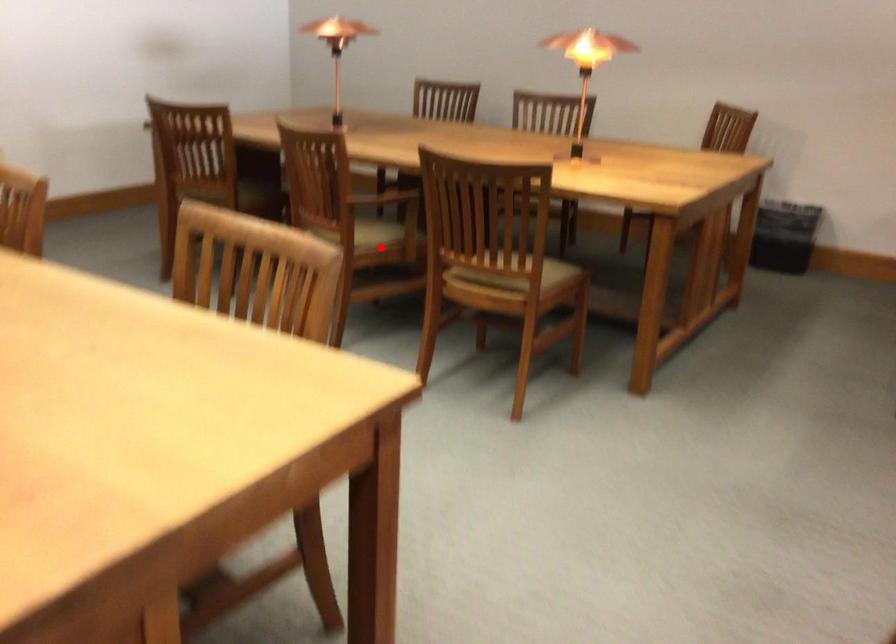
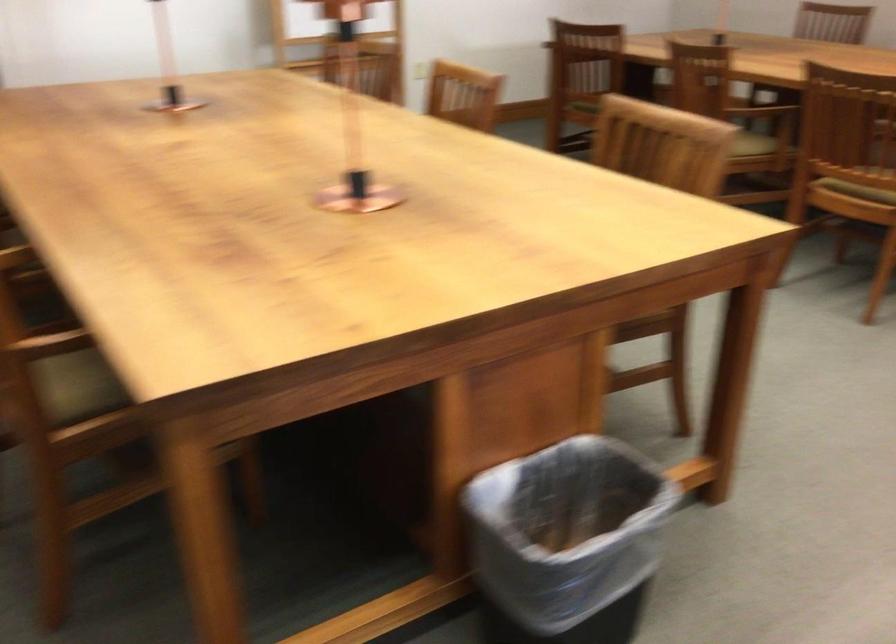
The point at the highlighted location is marked in the first image. Where is the corresponding point in the second image?

(753, 144)